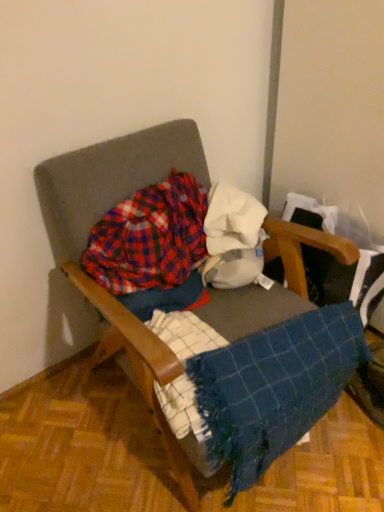
What do you see at coordinates (103, 289) in the screenshot?
I see `wooden armchair at center` at bounding box center [103, 289].

Find the location of `plaid fabric at center`. plaid fabric at center is located at coordinates (150, 238).

Identify the location of blue woven blanket at lower right. This screenshot has width=384, height=512. (274, 387).

From a real-world perspective, which object stands above the other?

plaid fabric at center, from a real-world perspective.

Is wooden armchair at center far from plaid fabric at center?

No.

Considering the relative sizes of wooden armchair at center and plaid fabric at center in the image provided, is wooden armchair at center wider than plaid fabric at center?

Yes, wooden armchair at center is wider than plaid fabric at center.

Is point (109, 164) closer or farther from the camera than point (166, 195)?

Point (109, 164) is positioned closer to the camera compared to point (166, 195).

Is plaid fabric at center not near blue woven blanket at lower right?

No.

Is plaid fabric at center located outside blue woven blanket at lower right?

Yes, plaid fabric at center is outside of blue woven blanket at lower right.

Considering the positions of point (121, 272) and point (226, 411), is point (121, 272) closer or farther from the camera than point (226, 411)?

Point (121, 272).

Is plaid fabric at center oriented towards blue woven blanket at lower right?

Yes, plaid fabric at center faces towards blue woven blanket at lower right.

Consider the image. From the image's perspective, is blue woven blanket at lower right above or below plaid fabric at center?

blue woven blanket at lower right is situated lower than plaid fabric at center in the image.

Is blue woven blanket at lower right located outside plaid fabric at center?

Yes.

Does blue woven blanket at lower right lie behind plaid fabric at center?

No, blue woven blanket at lower right is closer to the camera.

From the picture: Between blue woven blanket at lower right and plaid fabric at center, which one has larger size?

With larger size is blue woven blanket at lower right.

Which object is wider, plaid fabric at center or wooden armchair at center?

With larger width is wooden armchair at center.

Which is more to the right, plaid fabric at center or wooden armchair at center?

wooden armchair at center is more to the right.

Between wooden armchair at center and blue woven blanket at lower right, which one has less height?

Standing shorter between the two is blue woven blanket at lower right.

Based on the photo, is wooden armchair at center to the left or to the right of blue woven blanket at lower right in the image?

From the image, it's evident that wooden armchair at center is to the left of blue woven blanket at lower right.

Is point (82, 285) behind point (279, 338)?

Yes, point (82, 285) is farther from viewer.

Measure the distance between blue woven blanket at lower right and wooden armchair at center.

blue woven blanket at lower right is 10.93 inches away from wooden armchair at center.

Can you confirm if blue woven blanket at lower right is bigger than wooden armchair at center?

Incorrect, blue woven blanket at lower right is not larger than wooden armchair at center.

Is blue woven blanket at lower right positioned in front of wooden armchair at center?

No, blue woven blanket at lower right is further to the viewer.

Based on the photo, is blue woven blanket at lower right not near wooden armchair at center?

blue woven blanket at lower right is near wooden armchair at center, not far away.

Find the location of `flannel above the wooden armchair at center (from the image's perspective)`. flannel above the wooden armchair at center (from the image's perspective) is located at coordinates (150, 238).

Where is `flannel above the blue woven blanket at lower right (from a real-world perspective)`? flannel above the blue woven blanket at lower right (from a real-world perspective) is located at coordinates (150, 238).

From the picture: When comparing their distances from plaid fabric at center, does blue woven blanket at lower right or wooden armchair at center seem further?

blue woven blanket at lower right lies further to plaid fabric at center than the other object.

Which object lies nearer to the anchor point wooden armchair at center, blue woven blanket at lower right or plaid fabric at center?

plaid fabric at center is positioned closer to the anchor wooden armchair at center.

When comparing their distances from wooden armchair at center, does plaid fabric at center or blue woven blanket at lower right seem closer?

Among the two, plaid fabric at center is located nearer to wooden armchair at center.

Estimate the real-world distances between objects in this image. Which object is further from blue woven blanket at lower right, wooden armchair at center or plaid fabric at center?

Among the two, plaid fabric at center is located further to blue woven blanket at lower right.

From the image, which object appears to be nearer to plaid fabric at center, wooden armchair at center or blue woven blanket at lower right?

The object closer to plaid fabric at center is wooden armchair at center.

From the image, which object appears to be farther from blue woven blanket at lower right, plaid fabric at center or wooden armchair at center?

plaid fabric at center.

Where is `furniture between plaid fabric at center and blue woven blanket at lower right in the vertical direction`? The width and height of the screenshot is (384, 512). furniture between plaid fabric at center and blue woven blanket at lower right in the vertical direction is located at coordinates (103, 289).